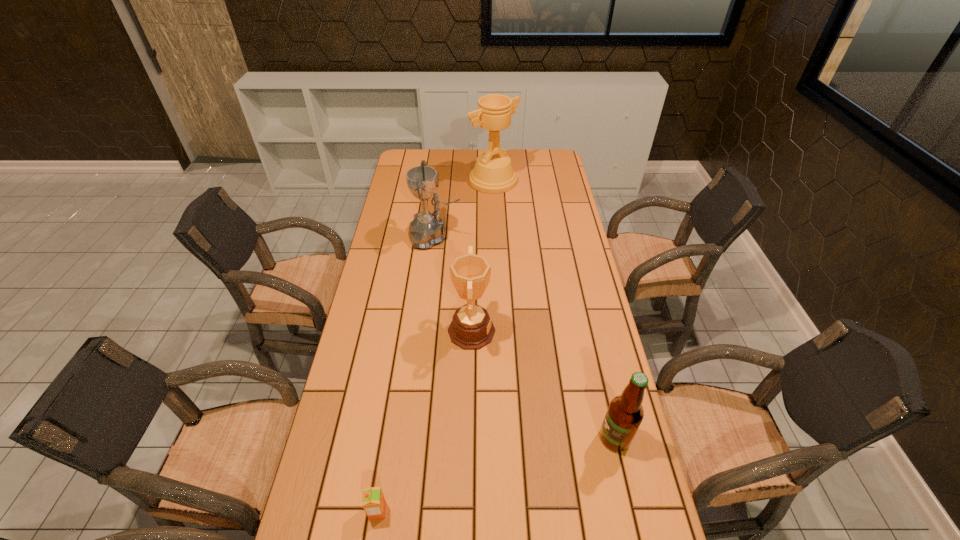
At what (x,y) coordinates should I click in order to perform the action: click on blank space at the left edge of the desktop. Please return your answer as a coordinate pair (x, y). The image size is (960, 540). Looking at the image, I should click on (368, 277).

In the image, there is a desktop. What are the coordinates of `vacant space at the right edge` in the screenshot? It's located at (546, 177).

The height and width of the screenshot is (540, 960). In the image, there is a desktop. Find the location of `blank space at the far right corner`. blank space at the far right corner is located at coordinates (554, 150).

At what (x,y) coordinates should I click in order to perform the action: click on free space between the orange juice and the second farthest award. Please return your answer as a coordinate pair (x, y). The width and height of the screenshot is (960, 540). Looking at the image, I should click on (406, 374).

This screenshot has height=540, width=960. Find the location of `free space between the orange juice and the beer bottle`. free space between the orange juice and the beer bottle is located at coordinates (496, 475).

Locate an element on the screen. vacant region between the tallest object and the beer bottle is located at coordinates (554, 309).

Locate an element on the screen. vacant space in between the tallest object and the second nearest award is located at coordinates (465, 209).

Locate an element on the screen. This screenshot has width=960, height=540. vacant area that lies between the tallest award and the orange juice is located at coordinates (436, 346).

Where is `free point between the tallest award and the fourth nearest object`? free point between the tallest award and the fourth nearest object is located at coordinates (465, 209).

Where is `free space between the beer bottle and the farthest object`? This screenshot has height=540, width=960. free space between the beer bottle and the farthest object is located at coordinates (554, 309).